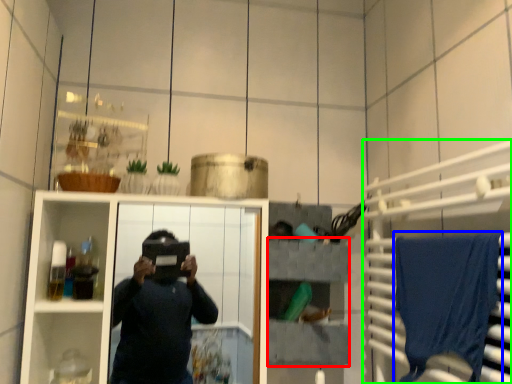
Question: Which object is the farthest from shelf (highlighted by a red box)? Choose among these: bath towel (highlighted by a blue box) or cabinet (highlighted by a green box).

Choices:
 (A) bath towel
 (B) cabinet

Answer: (A)